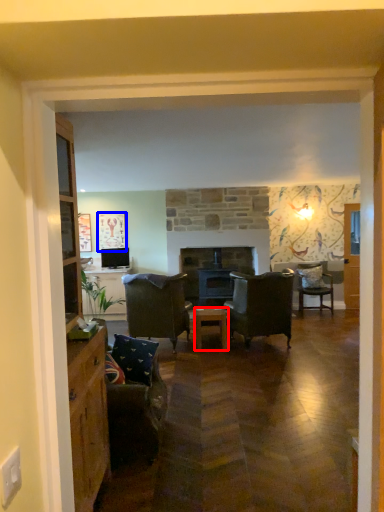
Question: Which object is further to the camera taking this photo, table (highlighted by a red box) or picture frame (highlighted by a blue box)?

Choices:
 (A) table
 (B) picture frame

Answer: (B)